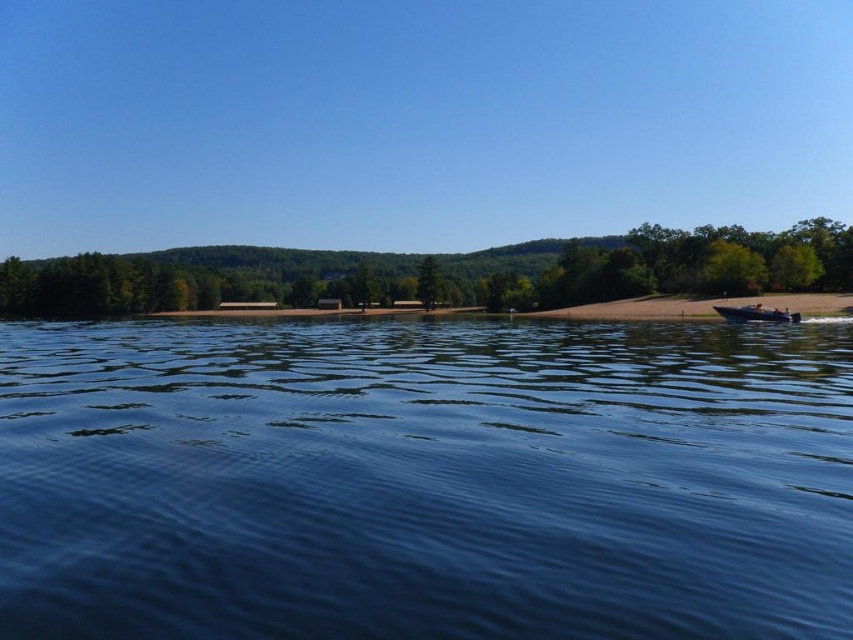
Is point (184, 282) positioned before point (432, 288)?

That is False.

This screenshot has height=640, width=853. In order to click on green leafy tree at center in this screenshot , I will do `click(653, 266)`.

Identify the location of green leafy tree at center. (653, 266).

What do you see at coordinates (756, 314) in the screenshot? I see `shiny silver speedboat at right` at bounding box center [756, 314].

Between point (779, 317) and point (419, 266), which one is positioned behind?

The point (419, 266) is behind.

The image size is (853, 640). What are the coordinates of `shiny silver speedboat at right` in the screenshot? It's located at (756, 314).

Where is `shiny silver speedboat at right`? This screenshot has height=640, width=853. shiny silver speedboat at right is located at coordinates (756, 314).

Can you confirm if blue smooth water at center is positioned above shiny silver speedboat at right?

No.

The image size is (853, 640). What do you see at coordinates (424, 480) in the screenshot?
I see `blue smooth water at center` at bounding box center [424, 480].

Measure the distance between blue smooth water at center and camera.

blue smooth water at center and camera are 17.69 feet apart from each other.

Find the location of a particular element. blue smooth water at center is located at coordinates (424, 480).